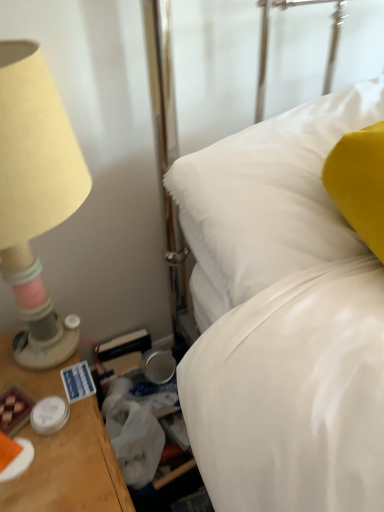
Describe the element at coordinates (283, 317) in the screenshot. I see `white satin bed at center` at that location.

What is the approximate width of white satin bed at center?

The width of white satin bed at center is 18.49 inches.

The image size is (384, 512). In order to click on white satin bed at center in this screenshot , I will do `click(283, 317)`.

Describe the element at coordinates (35, 193) in the screenshot. I see `beige fabric lampshade at left` at that location.

Identify the location of beige fabric lampshade at left. (35, 193).

In order to face beige fabric lampshade at left, should I rotate leftwards or rightwards?

It's best to rotate left around 21.967 degrees.

Find the location of a particular element. This screenshot has height=512, width=384. white satin bed at center is located at coordinates (283, 317).

Between white satin bed at center and beige fabric lampshade at left, which one appears on the right side from the viewer's perspective?

white satin bed at center.

In the scene shown: Does white satin bed at center come behind beige fabric lampshade at left?

Answer: Yes, white satin bed at center is further from the viewer.

Does point (218, 303) come behind point (17, 53)?

Yes, point (218, 303) is behind point (17, 53).

From the image's perspective, which is above, white satin bed at center or beige fabric lampshade at left?

white satin bed at center appears higher in the image.

From a real-world perspective, which is physically below, white satin bed at center or beige fabric lampshade at left?

beige fabric lampshade at left is physically lower.

Looking at this image, which object is wider, white satin bed at center or beige fabric lampshade at left?

Wider between the two is white satin bed at center.

Can you confirm if white satin bed at center is taller than beige fabric lampshade at left?

No.

Considering the sizes of objects white satin bed at center and beige fabric lampshade at left in the image provided, who is bigger, white satin bed at center or beige fabric lampshade at left?

white satin bed at center is bigger.

Looking at this image, is white satin bed at center not within beige fabric lampshade at left?

Indeed, white satin bed at center is completely outside beige fabric lampshade at left.

Are white satin bed at center and beige fabric lampshade at left far apart?

They are positioned close to each other.

Could you tell me if white satin bed at center is turned towards beige fabric lampshade at left?

No, white satin bed at center is not oriented towards beige fabric lampshade at left.

Find the location of a particular element. The width and height of the screenshot is (384, 512). lamp that appears below the white satin bed at center (from the image's perspective) is located at coordinates (35, 193).

Considering the relative positions of beige fabric lampshade at left and white satin bed at center in the image provided, is beige fabric lampshade at left to the left of white satin bed at center from the viewer's perspective?

Indeed, beige fabric lampshade at left is positioned on the left side of white satin bed at center.

Looking at this image, is the position of beige fabric lampshade at left less distant than that of white satin bed at center?

Yes, the depth of beige fabric lampshade at left is less than that of white satin bed at center.

Does point (10, 139) lie in front of point (286, 202)?

That is True.

From the image's perspective, who appears lower, beige fabric lampshade at left or white satin bed at center?

beige fabric lampshade at left.

From a real-world perspective, who is located lower, beige fabric lampshade at left or white satin bed at center?

From a 3D spatial view, beige fabric lampshade at left is below.

Can you confirm if beige fabric lampshade at left is thinner than white satin bed at center?

Yes.

Considering the sizes of objects beige fabric lampshade at left and white satin bed at center in the image provided, who is shorter, beige fabric lampshade at left or white satin bed at center?

white satin bed at center is shorter.

Looking at the image, does beige fabric lampshade at left seem bigger or smaller compared to white satin bed at center?

Considering their sizes, beige fabric lampshade at left takes up less space than white satin bed at center.

Can we say beige fabric lampshade at left lies outside white satin bed at center?

Yes, beige fabric lampshade at left is not within white satin bed at center.

Is there a large distance between beige fabric lampshade at left and white satin bed at center?

No, beige fabric lampshade at left is not far away from white satin bed at center.

Is beige fabric lampshade at left facing away from white satin bed at center?

No, beige fabric lampshade at left's orientation is not away from white satin bed at center.

Where is `lamp directly beneath the white satin bed at center (from a real-world perspective)`? This screenshot has width=384, height=512. lamp directly beneath the white satin bed at center (from a real-world perspective) is located at coordinates (35, 193).

The image size is (384, 512). Identify the location of bed above the beige fabric lampshade at left (from the image's perspective). (283, 317).

Image resolution: width=384 pixels, height=512 pixels. Identify the location of bed that appears above the beige fabric lampshade at left (from a real-world perspective). (283, 317).